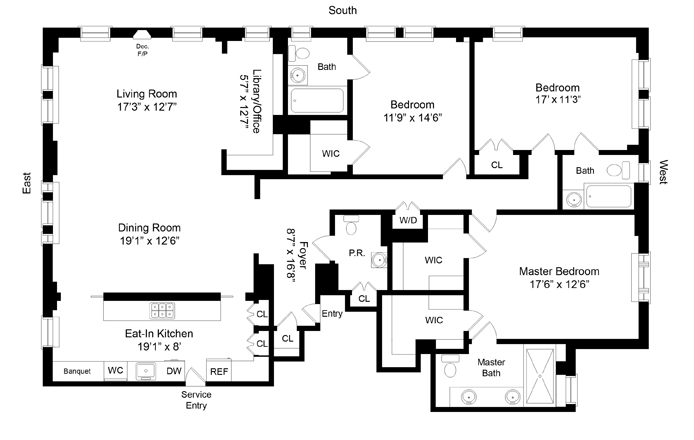
The image size is (694, 440). What are the coordinates of `the 2nd bedroom` in the screenshot? It's located at (446, 119).